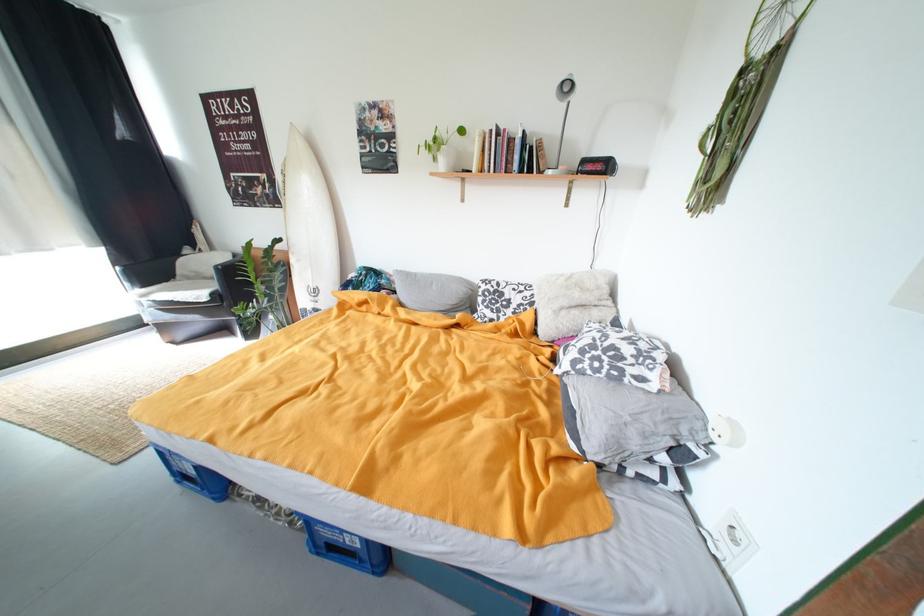
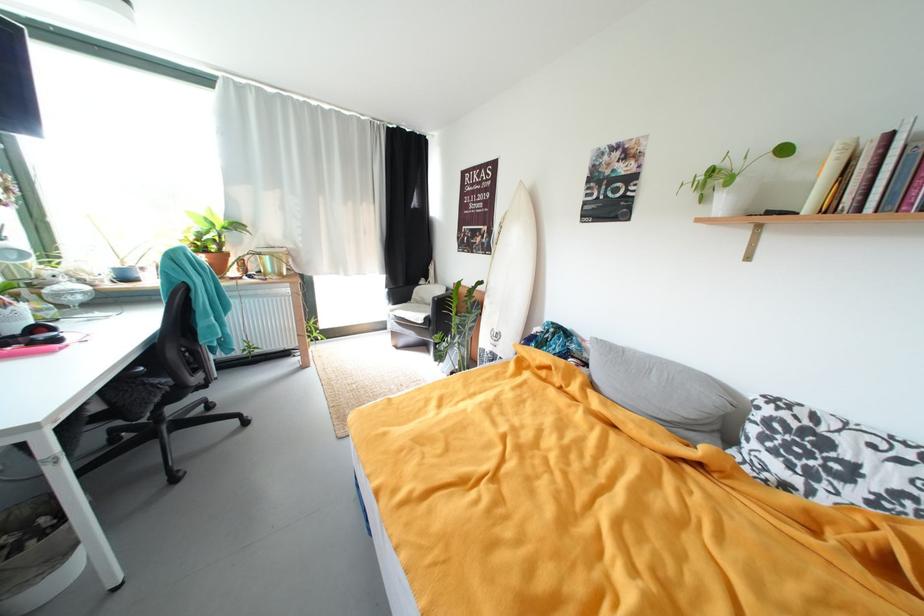
The point at [281,184] is marked in the first image. Where is the corresponding point in the second image?

(497, 235)